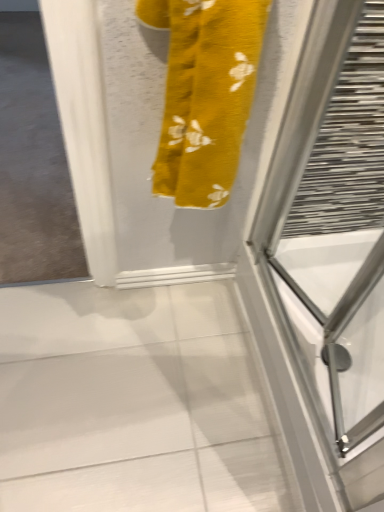
In order to face yellow fabric towel at upper center, should I rotate leftwards or rightwards?

You should look right and rotate roughly 0.138 degrees.

The image size is (384, 512). Describe the element at coordinates (205, 94) in the screenshot. I see `yellow fabric towel at upper center` at that location.

Where is `yellow fabric towel at upper center`? Image resolution: width=384 pixels, height=512 pixels. yellow fabric towel at upper center is located at coordinates (205, 94).

Identify the location of transparent glass screen door at right. This screenshot has height=512, width=384. (327, 259).

What do you see at coordinates (327, 259) in the screenshot? I see `transparent glass screen door at right` at bounding box center [327, 259].

Locate an element on the screen. This screenshot has width=384, height=512. yellow fabric towel at upper center is located at coordinates (205, 94).

Which is more to the right, yellow fabric towel at upper center or transparent glass screen door at right?

transparent glass screen door at right is more to the right.

Is yellow fabric towel at upper center positioned behind transparent glass screen door at right?

No, the depth of yellow fabric towel at upper center is less than that of transparent glass screen door at right.

Is point (209, 59) positioned behind point (369, 5)?

No, it is in front of (369, 5).

From the image's perspective, which object appears higher, yellow fabric towel at upper center or transparent glass screen door at right?

yellow fabric towel at upper center is shown above in the image.

From a real-world perspective, is yellow fabric towel at upper center physically below transparent glass screen door at right?

No, from a real-world perspective, yellow fabric towel at upper center is not below transparent glass screen door at right.

Considering the sizes of yellow fabric towel at upper center and transparent glass screen door at right in the image, is yellow fabric towel at upper center wider or thinner than transparent glass screen door at right?

Clearly, yellow fabric towel at upper center has less width compared to transparent glass screen door at right.

Can you confirm if yellow fabric towel at upper center is taller than transparent glass screen door at right?

Yes.

Between yellow fabric towel at upper center and transparent glass screen door at right, which one has larger size?

transparent glass screen door at right is bigger.

Is transparent glass screen door at right completely or partially inside yellow fabric towel at upper center?

That's incorrect, transparent glass screen door at right is not inside yellow fabric towel at upper center.

Are yellow fabric towel at upper center and transparent glass screen door at right far apart?

They are positioned close to each other.

Could you tell me if yellow fabric towel at upper center is facing transparent glass screen door at right?

No, yellow fabric towel at upper center is not oriented towards transparent glass screen door at right.

Can you tell me how much yellow fabric towel at upper center and transparent glass screen door at right differ in facing direction?

They differ by 90 degrees in their facing directions.

The image size is (384, 512). Identify the location of screen door located on the right of yellow fabric towel at upper center. (327, 259).

Is transparent glass screen door at right at the right side of yellow fabric towel at upper center?

Yes.

Is transparent glass screen door at right closer to the viewer compared to yellow fabric towel at upper center?

No.

Considering the positions of points (379, 229) and (163, 167), is point (379, 229) closer to camera compared to point (163, 167)?

No, (379, 229) is further to viewer.

From the image's perspective, is transparent glass screen door at right beneath yellow fabric towel at upper center?

Indeed, from the image's perspective, transparent glass screen door at right is shown beneath yellow fabric towel at upper center.

From a real-world perspective, is transparent glass screen door at right physically above yellow fabric towel at upper center?

No, from a real-world perspective, transparent glass screen door at right is not above yellow fabric towel at upper center.

Is transparent glass screen door at right thinner than yellow fabric towel at upper center?

No.

Looking at this image, considering the sizes of objects transparent glass screen door at right and yellow fabric towel at upper center in the image provided, who is shorter, transparent glass screen door at right or yellow fabric towel at upper center?

With less height is transparent glass screen door at right.

Considering the sizes of objects transparent glass screen door at right and yellow fabric towel at upper center in the image provided, who is bigger, transparent glass screen door at right or yellow fabric towel at upper center?

With larger size is transparent glass screen door at right.

Is transparent glass screen door at right not inside yellow fabric towel at upper center?

That's correct, transparent glass screen door at right is outside of yellow fabric towel at upper center.

Based on the photo, is transparent glass screen door at right far from yellow fabric towel at upper center?

No, transparent glass screen door at right is not far away from yellow fabric towel at upper center.

Is transparent glass screen door at right facing towards yellow fabric towel at upper center?

No.

What's the angular difference between transparent glass screen door at right and yellow fabric towel at upper center's facing directions?

There is a 90-degree angle between the facing directions of transparent glass screen door at right and yellow fabric towel at upper center.

Where is `towel above the transparent glass screen door at right (from a real-world perspective)`? The height and width of the screenshot is (512, 384). towel above the transparent glass screen door at right (from a real-world perspective) is located at coordinates (205, 94).

Where is `towel that is above the transparent glass screen door at right (from a real-world perspective)`? This screenshot has width=384, height=512. towel that is above the transparent glass screen door at right (from a real-world perspective) is located at coordinates (205, 94).

Locate an element on the screen. screen door on the right of yellow fabric towel at upper center is located at coordinates (327, 259).